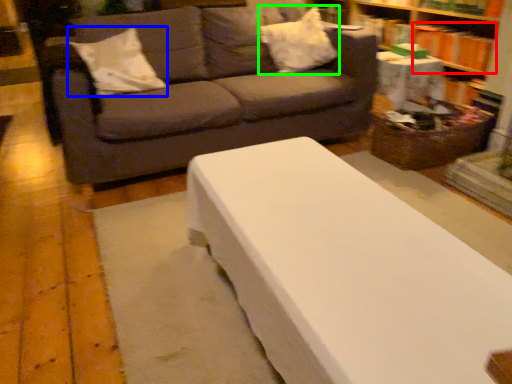
Question: Which object is positioned farthest from book (highlighted by a red box)? Select from pillow (highlighted by a blue box) and pillow (highlighted by a green box).

Choices:
 (A) pillow
 (B) pillow

Answer: (A)